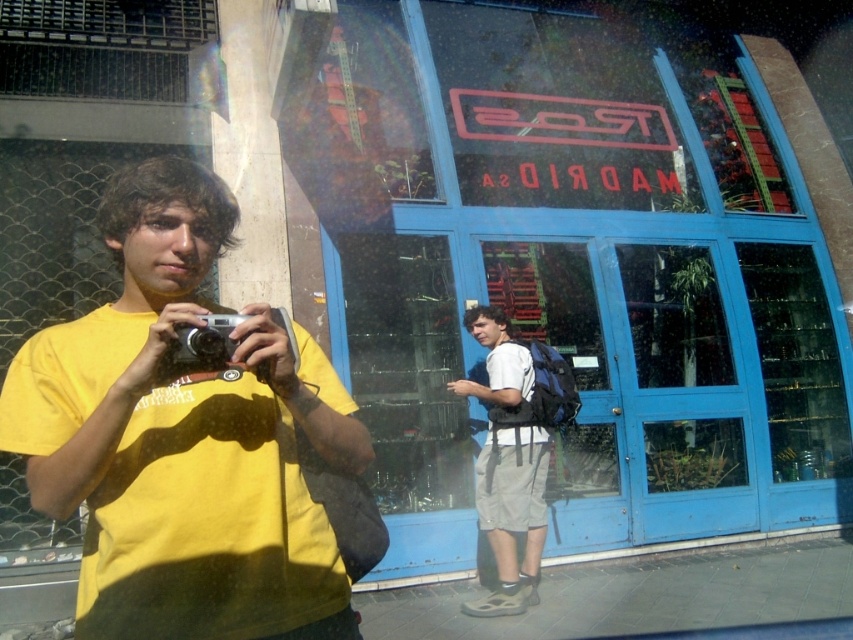
Question: Does yellow matte t-shirt at left lie behind white matte backpack at center?

Choices:
 (A) no
 (B) yes

Answer: (A)

Question: Which point is closer to the camera?

Choices:
 (A) (91, 355)
 (B) (210, 342)
 (C) (534, 525)

Answer: (B)

Question: Does yellow matte t-shirt at left appear on the right side of silver metallic camera at center?

Choices:
 (A) no
 (B) yes

Answer: (A)

Question: Is yellow matte t-shirt at left in front of silver metallic camera at center?

Choices:
 (A) no
 (B) yes

Answer: (B)

Question: Based on their relative distances, which object is farther from the silver metallic camera at center?

Choices:
 (A) yellow matte t-shirt at left
 (B) white matte backpack at center

Answer: (B)

Question: Which of the following is the farthest from the observer?

Choices:
 (A) yellow matte t-shirt at left
 (B) white matte backpack at center

Answer: (B)